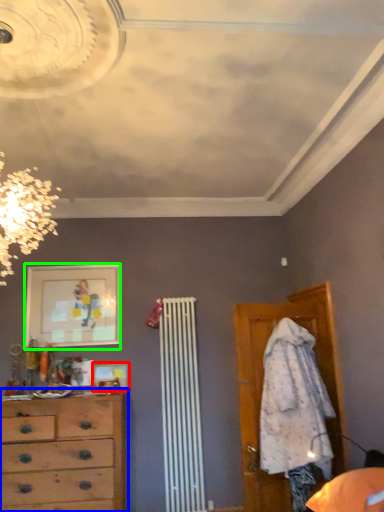
Question: Which object is the farthest from picture frame (highlighted by a red box)? Choose among these: chest of drawers (highlighted by a blue box) or picture frame (highlighted by a green box).

Choices:
 (A) chest of drawers
 (B) picture frame

Answer: (B)